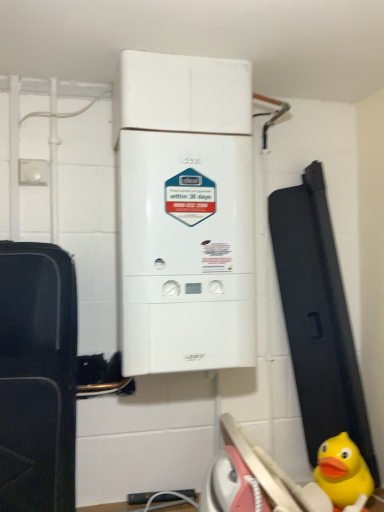
Image resolution: width=384 pixels, height=512 pixels. What do you see at coordinates (342, 471) in the screenshot?
I see `yellow rubber duck at lower right` at bounding box center [342, 471].

Identify the location of yellow rubber duck at lower right. The image size is (384, 512). (342, 471).

Locate an element on the screen. white matte boiler at center is located at coordinates (184, 213).

What do you see at coordinates (184, 213) in the screenshot? The image size is (384, 512). I see `white matte boiler at center` at bounding box center [184, 213].

Identify the location of yellow rubber duck at lower right. The image size is (384, 512). (342, 471).

Based on the photo, can you confirm if yellow rubber duck at lower right is positioned to the right of white matte boiler at center?

Indeed, yellow rubber duck at lower right is positioned on the right side of white matte boiler at center.

Relative to white matte boiler at center, is yellow rubber duck at lower right in front or behind?

Clearly, yellow rubber duck at lower right is behind white matte boiler at center.

Does point (319, 455) come in front of point (193, 82)?

That is False.

From the image's perspective, which is below, yellow rubber duck at lower right or white matte boiler at center?

yellow rubber duck at lower right appears lower in the image.

From a real-world perspective, is yellow rubber duck at lower right physically located above or below white matte boiler at center?

From a real-world perspective, yellow rubber duck at lower right is physically below white matte boiler at center.

Which object is wider, yellow rubber duck at lower right or white matte boiler at center?

white matte boiler at center is wider.

Which of these two, yellow rubber duck at lower right or white matte boiler at center, stands shorter?

yellow rubber duck at lower right is shorter.

Considering the relative sizes of yellow rubber duck at lower right and white matte boiler at center in the image provided, is yellow rubber duck at lower right bigger than white matte boiler at center?

No.

Is yellow rubber duck at lower right inside the boundaries of white matte boiler at center, or outside?

yellow rubber duck at lower right is not inside white matte boiler at center, it's outside.

Is yellow rubber duck at lower right positioned far away from white matte boiler at center?

No, yellow rubber duck at lower right is in close proximity to white matte boiler at center.

Is yellow rubber duck at lower right aimed at white matte boiler at center?

No, yellow rubber duck at lower right is not facing towards white matte boiler at center.

How many degrees apart are the facing directions of yellow rubber duck at lower right and white matte boiler at center?

yellow rubber duck at lower right and white matte boiler at center are facing 46.8 degrees away from each other.

How distant is yellow rubber duck at lower right from white matte boiler at center?

The distance of yellow rubber duck at lower right from white matte boiler at center is 29.47 inches.

Locate an element on the screen. The width and height of the screenshot is (384, 512). home appliance on the left of yellow rubber duck at lower right is located at coordinates (184, 213).

Would you say white matte boiler at center is to the left or to the right of yellow rubber duck at lower right in the picture?

From the image, it's evident that white matte boiler at center is to the left of yellow rubber duck at lower right.

Relative to yellow rubber duck at lower right, is white matte boiler at center in front or behind?

Clearly, white matte boiler at center is in front of yellow rubber duck at lower right.

Considering the positions of point (217, 168) and point (353, 477), is point (217, 168) closer or farther from the camera than point (353, 477)?

Clearly, point (217, 168) is closer to the camera than point (353, 477).

From the image's perspective, would you say white matte boiler at center is shown under yellow rubber duck at lower right?

Incorrect, from the image's perspective, white matte boiler at center is higher than yellow rubber duck at lower right.

From a real-world perspective, which is physically above, white matte boiler at center or yellow rubber duck at lower right?

white matte boiler at center is physically above.

Is white matte boiler at center wider or thinner than yellow rubber duck at lower right?

Considering their sizes, white matte boiler at center looks broader than yellow rubber duck at lower right.

Considering the sizes of white matte boiler at center and yellow rubber duck at lower right in the image, is white matte boiler at center taller or shorter than yellow rubber duck at lower right?

Considering their sizes, white matte boiler at center has more height than yellow rubber duck at lower right.

Considering the relative sizes of white matte boiler at center and yellow rubber duck at lower right in the image provided, is white matte boiler at center smaller than yellow rubber duck at lower right?

No, white matte boiler at center is not smaller than yellow rubber duck at lower right.

Is white matte boiler at center not within yellow rubber duck at lower right?

Yes, white matte boiler at center is located beyond the bounds of yellow rubber duck at lower right.

Is white matte boiler at center not close to yellow rubber duck at lower right?

No.

Could you tell me if white matte boiler at center is facing yellow rubber duck at lower right?

No, white matte boiler at center does not turn towards yellow rubber duck at lower right.

In the image, there is a yellow rubber duck at lower right. Identify the location of home appliance above it (from the image's perspective). (184, 213).

Where is `toy behind the white matte boiler at center`? toy behind the white matte boiler at center is located at coordinates (342, 471).

Locate an element on the screen. toy that is under the white matte boiler at center (from a real-world perspective) is located at coordinates coord(342,471).